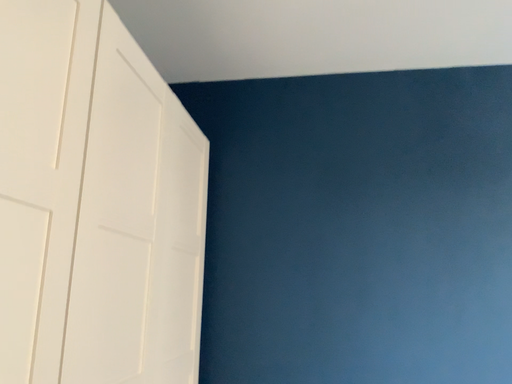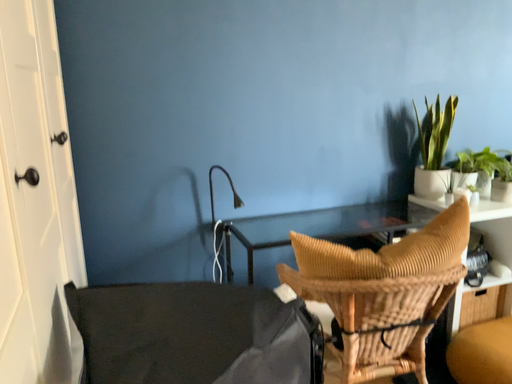
Question: How did the camera likely rotate when shooting the video?

Choices:
 (A) rotated right
 (B) rotated left

Answer: (A)